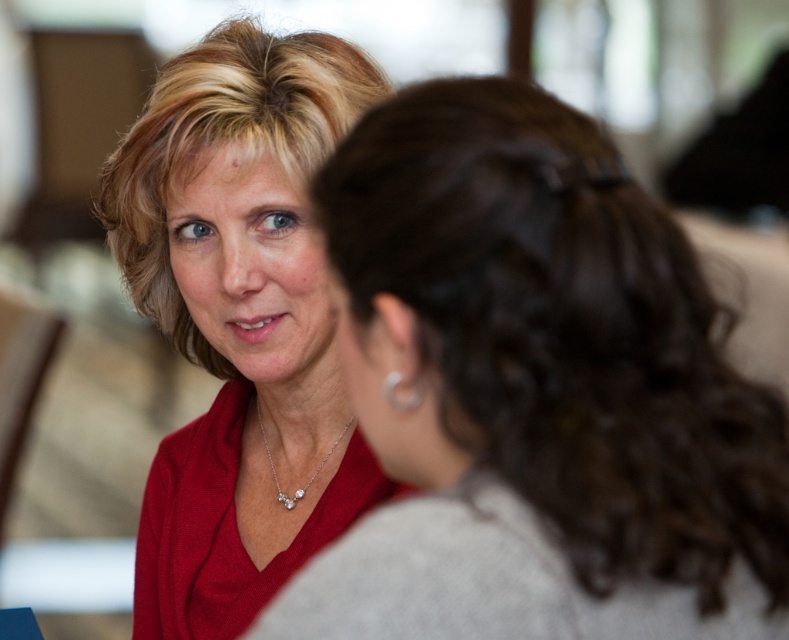
Can you confirm if matte red blouse at upper left is taller than silver metallic earring at upper right?

Correct, matte red blouse at upper left is much taller as silver metallic earring at upper right.

Is matte red blouse at upper left wider than silver metallic earring at upper right?

Yes, matte red blouse at upper left is wider than silver metallic earring at upper right.

Who is more forward, [436,605] or [387,388]?

Point [436,605]

The height and width of the screenshot is (640, 789). I want to click on matte red blouse at upper left, so click(535, 392).

Who is more distant from viewer, (409, 378) or (260, 576)?

Point (260, 576)

Between point (352, 256) and point (264, 211), which one is positioned in front?

Point (352, 256)

The width and height of the screenshot is (789, 640). What do you see at coordinates (535, 392) in the screenshot?
I see `matte red blouse at upper left` at bounding box center [535, 392].

The image size is (789, 640). I want to click on matte red blouse at upper left, so click(535, 392).

Can you confirm if matte red blouse at center is taller than silver metallic earring at upper right?

Indeed, matte red blouse at center has a greater height compared to silver metallic earring at upper right.

Which is more to the left, matte red blouse at center or silver metallic earring at upper right?

From the viewer's perspective, matte red blouse at center appears more on the left side.

Does point (312, 64) come behind point (394, 397)?

Yes.

The image size is (789, 640). What are the coordinates of `matte red blouse at center` in the screenshot? It's located at (238, 321).